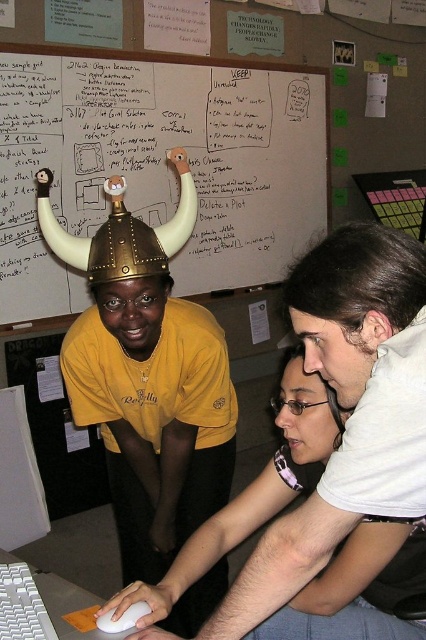
You are standing in the workspace and want to place a new object exactly where the matte gold helmet at center is currently located. What are the coordinates you should use for placement?

The coordinates for the matte gold helmet at center are 0.589 on the x axis and 0.347 on the y axis, so you should place the new object at point (x=147, y=376).

You are setting up a presentation and need to choose a mouse that will fit comfortably in your hand. The white matte mouse at center and the white matte mouse at lower center are both available. Which mouse should you choose based on their sizes?

The white matte mouse at center has a greater width than the white matte mouse at lower center, so it would be more comfortable to hold during the presentation.

From the picture: You are a person sitting at the computer in the workspace. You need to reach for the white matte mouse at center to adjust the cursor position. Is the mouse positioned in a standard ergonomic location for easy access?

The white matte mouse at center is located at point coordinates that may vary by individual preference, but typically, ergonomic setups place the mouse near the dominant hand side. Since the mouse is at the center, it might require reaching across, which could be less ergonomic depending on your seating position.